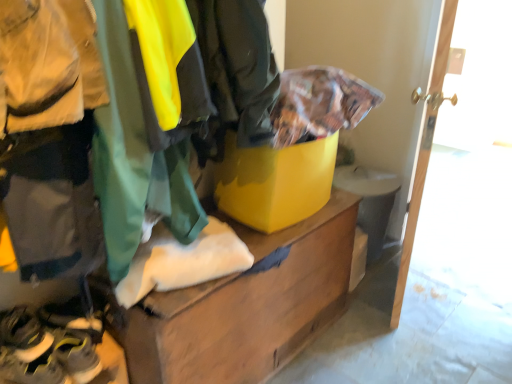
Find the location of a particular element. Image resolution: width=512 pixels, height=384 pixels. free point below wooden door at right (from a real-world perspective) is located at coordinates (393, 290).